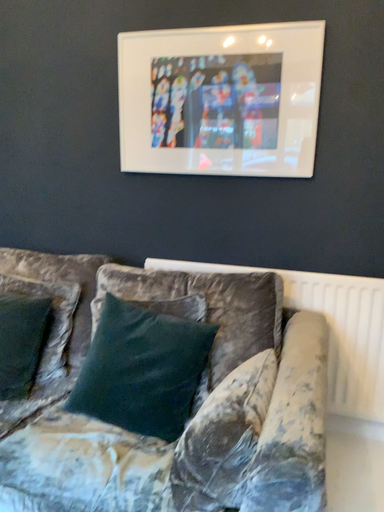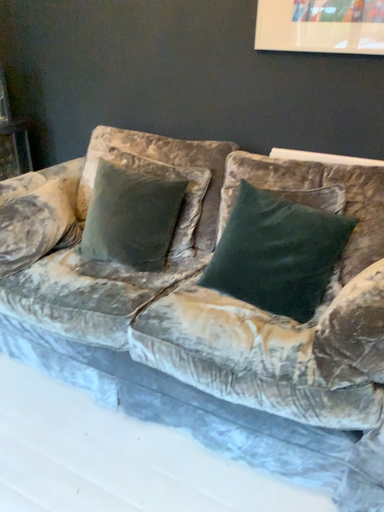
Question: How did the camera likely rotate when shooting the video?

Choices:
 (A) rotated left
 (B) rotated right

Answer: (A)